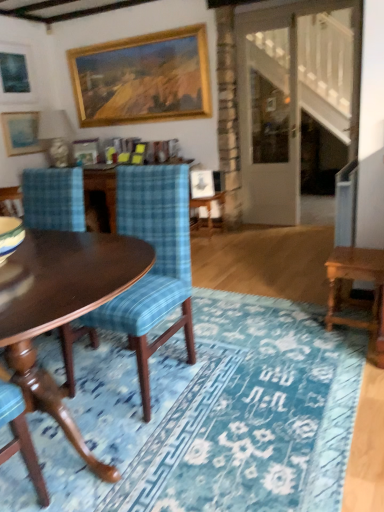
Locate an element on the screen. free space above blue textured rug at center (from a real-world perspective) is located at coordinates (218, 385).